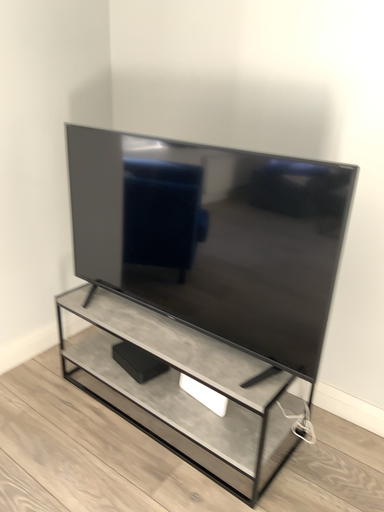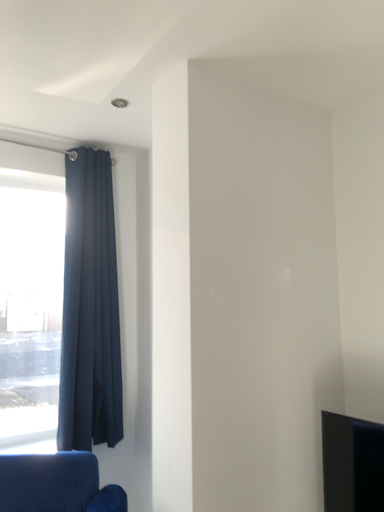
Question: Which way did the camera rotate in the video?

Choices:
 (A) rotated upward
 (B) rotated downward

Answer: (A)